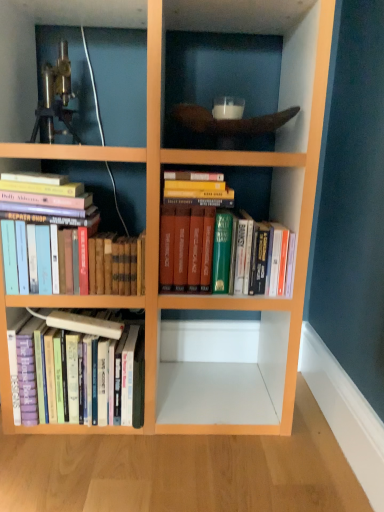
Question: Should I look upward or downward to see metallic tripod at upper left?

Choices:
 (A) down
 (B) up

Answer: (B)

Question: Does hardcover books at left, which is counted as the second book, starting from the left, have a lesser height compared to hardcover books at lower left, which appears as the first book when viewed from the left?

Choices:
 (A) yes
 (B) no

Answer: (A)

Question: From the image's perspective, is hardcover books at left, the 2th book positioned from the right, located beneath hardcover books at lower left, which ranks as the third book in right-to-left order?

Choices:
 (A) yes
 (B) no

Answer: (B)

Question: Are hardcover books at left, the 2th book positioned from the right, and hardcover books at lower left, which appears as the first book when viewed from the left, beside each other?

Choices:
 (A) no
 (B) yes

Answer: (A)

Question: From the image's perspective, is hardcover books at left, which is counted as the second book, starting from the left, on hardcover books at lower left, which ranks as the third book in right-to-left order?

Choices:
 (A) yes
 (B) no

Answer: (A)

Question: Does hardcover books at left, which is counted as the second book, starting from the left, turn towards hardcover books at lower left, which appears as the first book when viewed from the left?

Choices:
 (A) no
 (B) yes

Answer: (A)

Question: Would you say hardcover books at left, the 2th book positioned from the right, is outside hardcover books at lower left, which ranks as the third book in right-to-left order?

Choices:
 (A) yes
 (B) no

Answer: (A)

Question: From a real-world perspective, is metallic tripod at upper left below hardcover books at left, which is counted as the second book, starting from the left?

Choices:
 (A) yes
 (B) no

Answer: (B)

Question: Are metallic tripod at upper left and hardcover books at left, which is counted as the second book, starting from the left, making contact?

Choices:
 (A) yes
 (B) no

Answer: (B)

Question: From the image's perspective, is metallic tripod at upper left on hardcover books at left, the 2th book positioned from the right?

Choices:
 (A) no
 (B) yes

Answer: (B)

Question: Is metallic tripod at upper left positioned behind hardcover books at left, the 2th book positioned from the right?

Choices:
 (A) no
 (B) yes

Answer: (B)

Question: Is metallic tripod at upper left bigger than hardcover books at left, the 2th book positioned from the right?

Choices:
 (A) no
 (B) yes

Answer: (A)

Question: Can hardcover books at left, the 2th book positioned from the right, be found inside metallic tripod at upper left?

Choices:
 (A) no
 (B) yes

Answer: (A)

Question: Does hardcover books at lower left, which appears as the first book when viewed from the left, have a lesser height compared to metallic tripod at upper left?

Choices:
 (A) yes
 (B) no

Answer: (B)